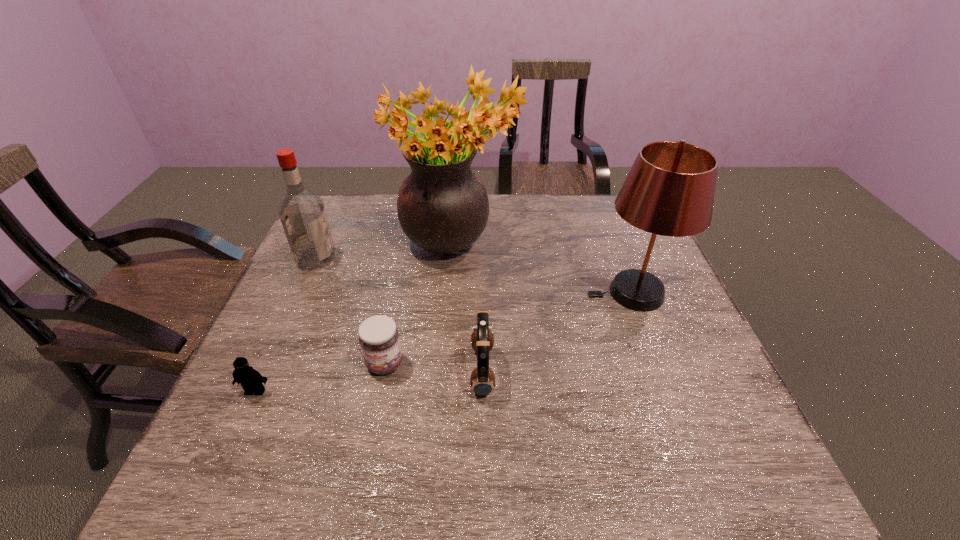
The width and height of the screenshot is (960, 540). Find the location of `free region at the far edge of the desktop`. free region at the far edge of the desktop is located at coordinates (521, 212).

The width and height of the screenshot is (960, 540). In order to click on vacant space at the near edge of the desktop in this screenshot , I will do `click(514, 474)`.

What are the coordinates of `vacant region at the left edge of the desktop` in the screenshot? It's located at (263, 363).

Find the location of a particular element. The image size is (960, 540). free space at the right edge of the desktop is located at coordinates (703, 390).

Find the location of a particular element. This screenshot has width=960, height=540. blank space at the far left corner of the desktop is located at coordinates (348, 194).

This screenshot has height=540, width=960. I want to click on free space at the far right corner of the desktop, so click(x=593, y=194).

The width and height of the screenshot is (960, 540). What are the coordinates of `vacant area between the jam and the flower arrangement` in the screenshot? It's located at (421, 303).

Locate an element on the screen. vacant space that's between the headset and the Lego is located at coordinates (369, 381).

Where is `empty location between the third shortest object and the jam`? empty location between the third shortest object and the jam is located at coordinates (434, 367).

The image size is (960, 540). Find the location of `vacant space that's between the liquor and the headset`. vacant space that's between the liquor and the headset is located at coordinates (399, 315).